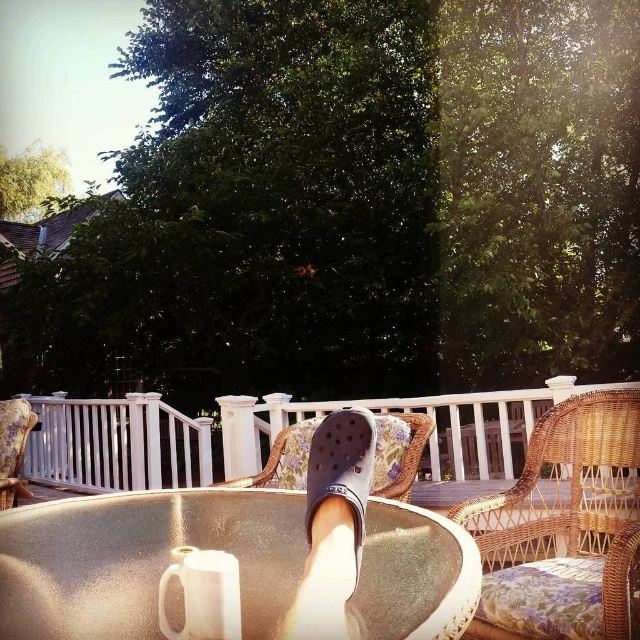
You are sitting at the table and want to move to one of the chairs. Which chair, the woven wicker chair at center or the woven rattan chair at center, is closer to you?

The woven wicker chair at center is closer to you because it is positioned further to the viewer than the woven rattan chair at center.

You are standing at the edge of the patio and want to sit down on the woven rattan chair at center. Is the gray rubber sandal at center blocking your path to the chair?

The gray rubber sandal at center is behind the woven rattan chair at center, so it is not blocking your path to the chair.